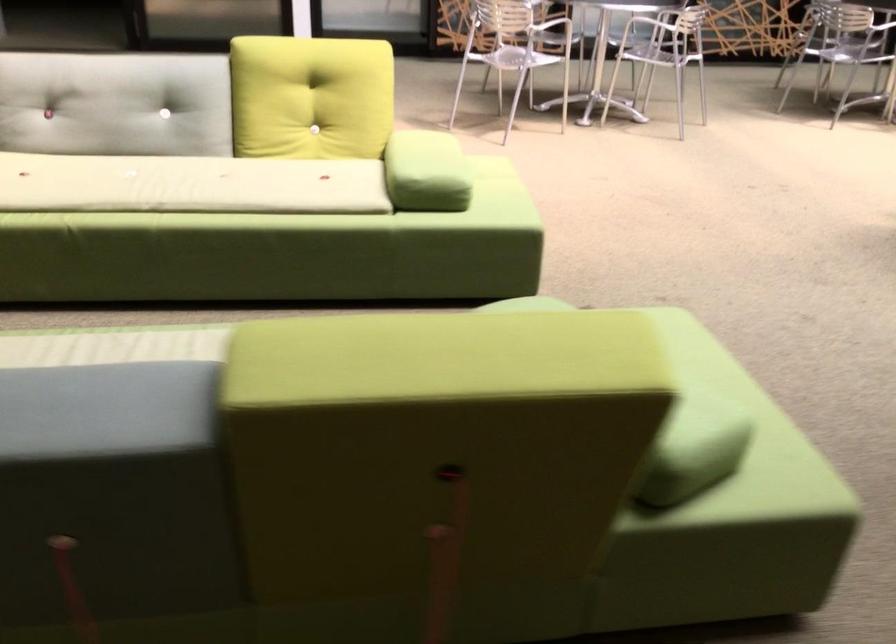
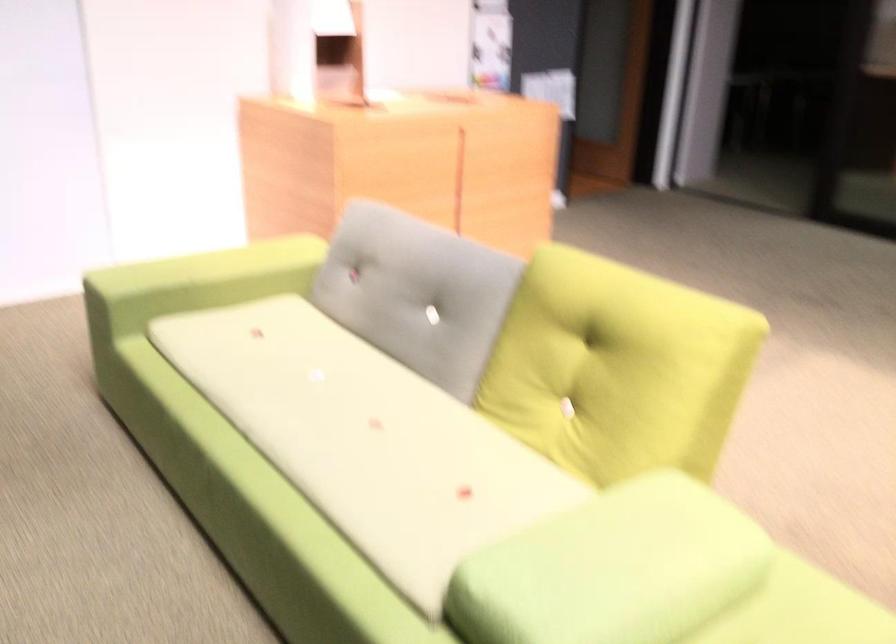
The point at (132,93) is marked in the first image. Where is the corresponding point in the second image?

(417, 292)